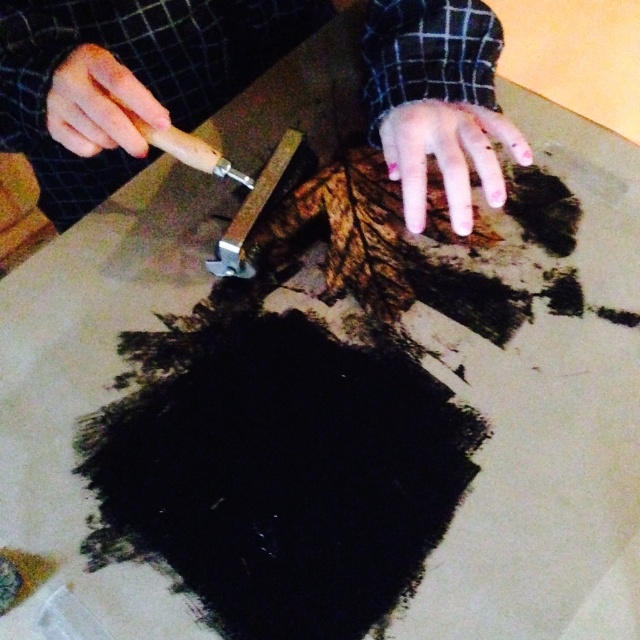
You are standing in front of the craft area and want to reach both the point at [483,164] and the point at [65,109]. Which point should you reach for first to avoid obstructing your view of the other?

You should reach for point [65,109] first because point [483,164] is behind it, so reaching the closer point first will prevent blocking your view of the one behind.

You are a robot arm trying to pick up the tool with the wooden handle and metallic tip. The point you need to reach is at point [61,74]. Can you safely reach that point without hitting the other hand resting on the wood or bark?

The point [61,74] is 22.31 inches away from the other hand resting on the wood or bark. Since the distance is sufficient, the robot arm can safely reach the point without hitting the other hand.